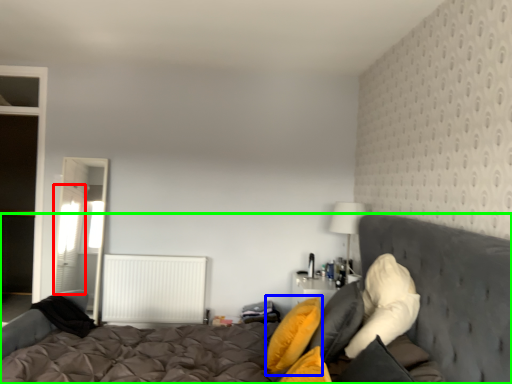
Question: Estimate the real-world distances between objects in this image. Which object is closer to curtain (highlighted by a red box), pillow (highlighted by a blue box) or bed (highlighted by a green box)?

Choices:
 (A) pillow
 (B) bed

Answer: (B)